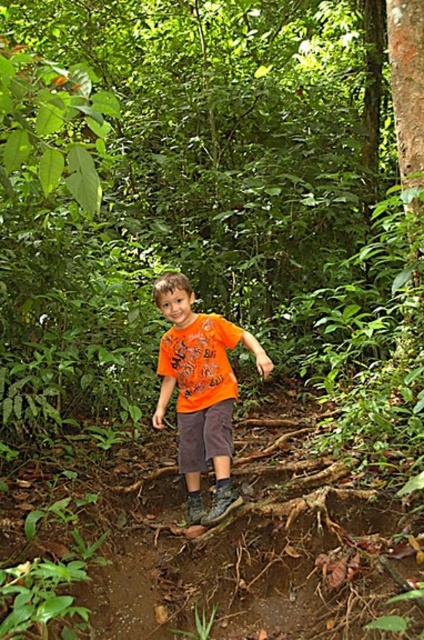
The child is wearing an orange cotton shirt at center and orange cotton shorts at center. Which piece of clothing covers a larger area on the child?

The orange cotton shirt at center covers a larger area on the child because it is larger in size than the orange cotton shorts at center.

You are a photographer trying to capture the child in the scene. Since the orange cotton shirt at center and orange cotton shorts at center are both visible, can you tell which one is covering the other?

The orange cotton shirt at center is positioned over orange cotton shorts at center, so the shirt is covering the shorts.